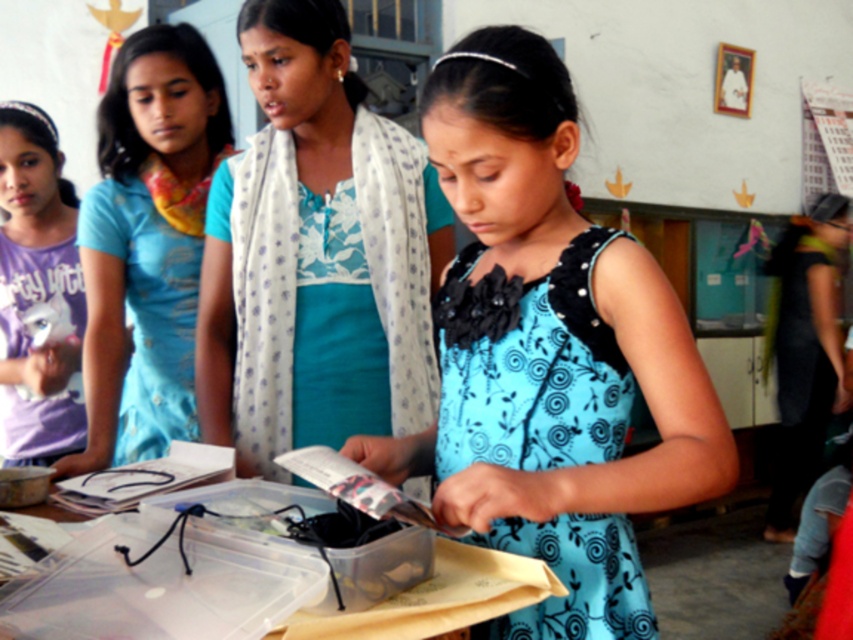
Question: Estimate the real-world distances between objects in this image. Which object is closer to the clear plastic table at center?

Choices:
 (A) blue fabric dress at center
 (B) dark green fabric dress at right
 (C) blue printed dress at center

Answer: (C)

Question: Estimate the real-world distances between objects in this image. Which object is closer to the purple cotton shirt at left?

Choices:
 (A) blue fabric dress at center
 (B) blue printed fabric dress at center
 (C) clear plastic table at center

Answer: (A)

Question: Is blue printed fabric dress at center to the right of purple cotton shirt at left from the viewer's perspective?

Choices:
 (A) no
 (B) yes

Answer: (B)

Question: Does blue printed fabric dress at center appear under clear plastic table at center?

Choices:
 (A) yes
 (B) no

Answer: (B)

Question: Which of the following is the farthest from the observer?

Choices:
 (A) (831, 401)
 (B) (508, 29)
 (C) (421, 301)
 (D) (202, 564)

Answer: (A)

Question: From the image, what is the correct spatial relationship of matte blue dress at left in relation to clear plastic table at center?

Choices:
 (A) left
 (B) right

Answer: (A)